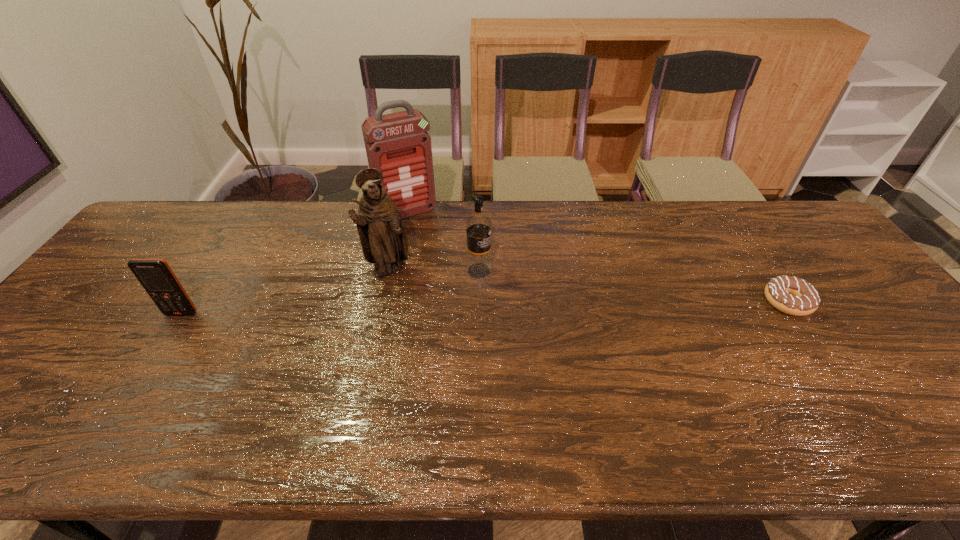
Where is `vacant area situated 0.290m on the back of the shortest object`? This screenshot has width=960, height=540. vacant area situated 0.290m on the back of the shortest object is located at coordinates (733, 222).

Identify the location of vacant space located on the front-facing side of the figurine. (462, 337).

At what (x,y) coordinates should I click in order to perform the action: click on free space located on the front-facing side of the figurine. Please return your answer as a coordinate pair (x, y). This screenshot has width=960, height=540. Looking at the image, I should click on [488, 362].

Find the location of a particular element. free space located 0.310m on the front-facing side of the figurine is located at coordinates (468, 345).

Locate an element on the screen. The width and height of the screenshot is (960, 540). blank space located on the label of the third tallest object is located at coordinates pos(593,325).

At what (x,y) coordinates should I click in order to perform the action: click on free space located on the label of the third tallest object. Please return your answer as a coordinate pair (x, y). Looking at the image, I should click on (593, 325).

Identify the location of vacant area located on the label of the third tallest object. This screenshot has height=540, width=960. (576, 317).

Find the location of `vacant region located on the front-facing side of the tallest object`. vacant region located on the front-facing side of the tallest object is located at coordinates (466, 300).

I want to click on vacant position located on the front-facing side of the tallest object, so (x=426, y=238).

Locate an element on the screen. The height and width of the screenshot is (540, 960). free region located 0.110m on the front-facing side of the tallest object is located at coordinates (430, 243).